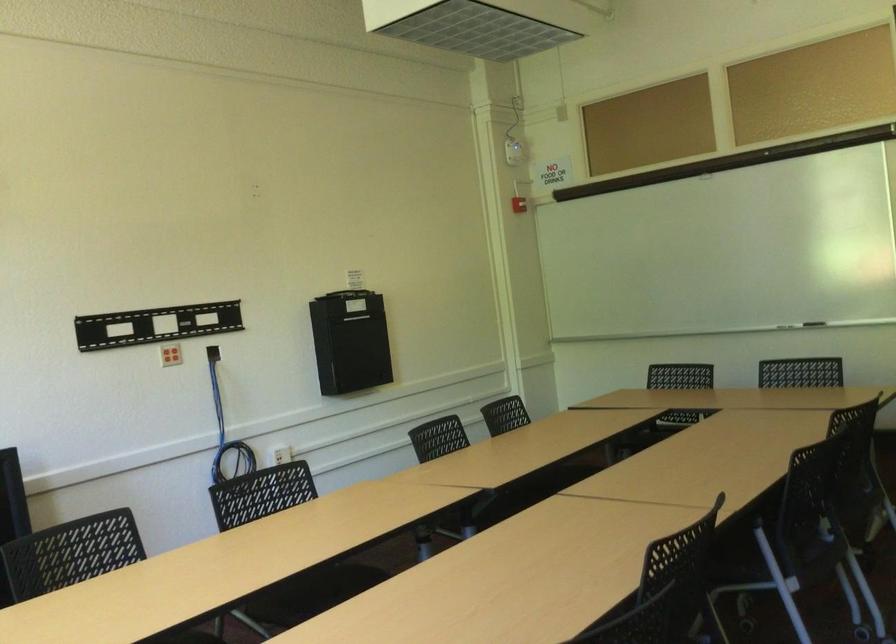
Where would you lift the whiteboard eraser? Please return your answer as a coordinate pair (x, y).

(814, 323)